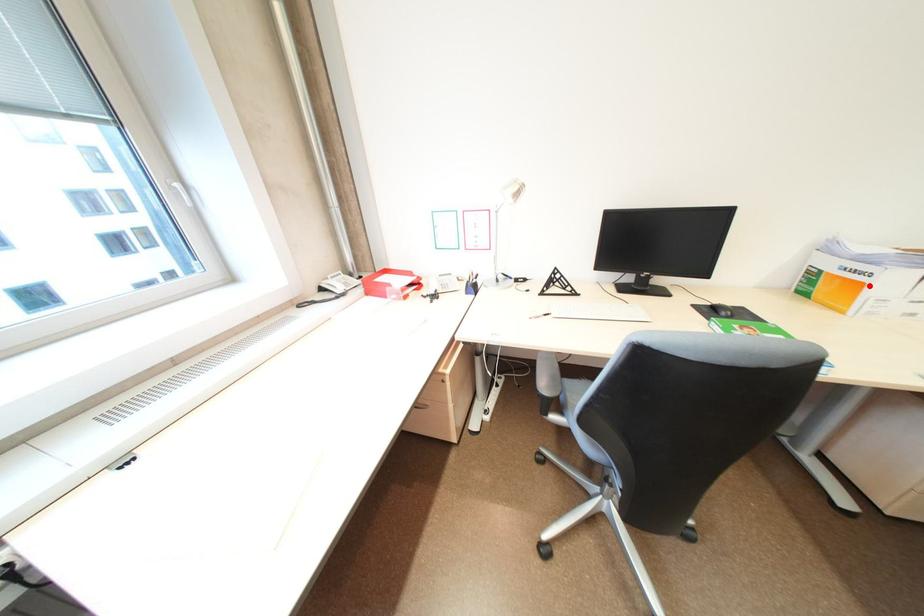
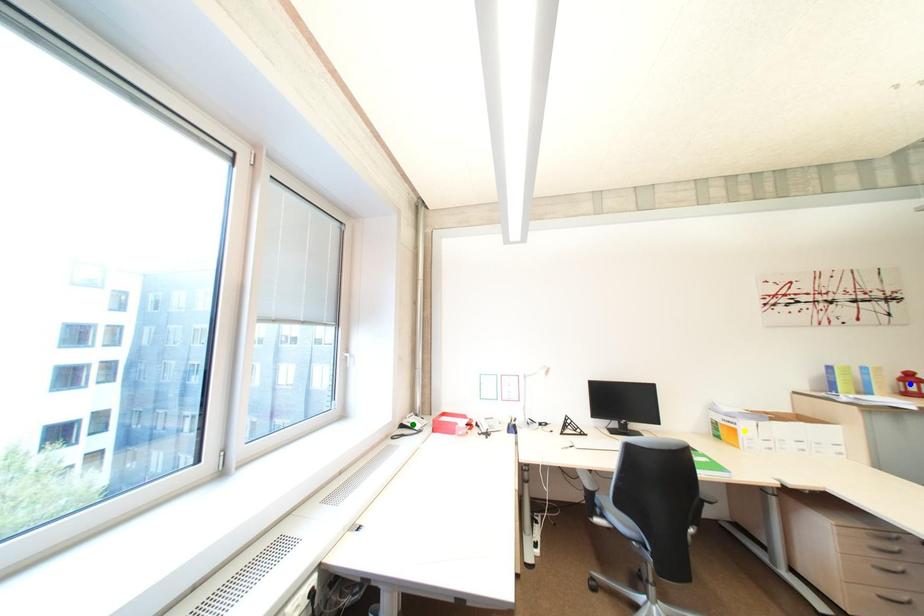
Question: I am providing you with two images of the same scene from different viewpoints. A red point is marked on the first image. You are given multiple points on the second image. Which point in image 2 represents the same 3d spot as the red point in image 1?

Choices:
 (A) green point
 (B) blue point
 (C) yellow point

Answer: (C)